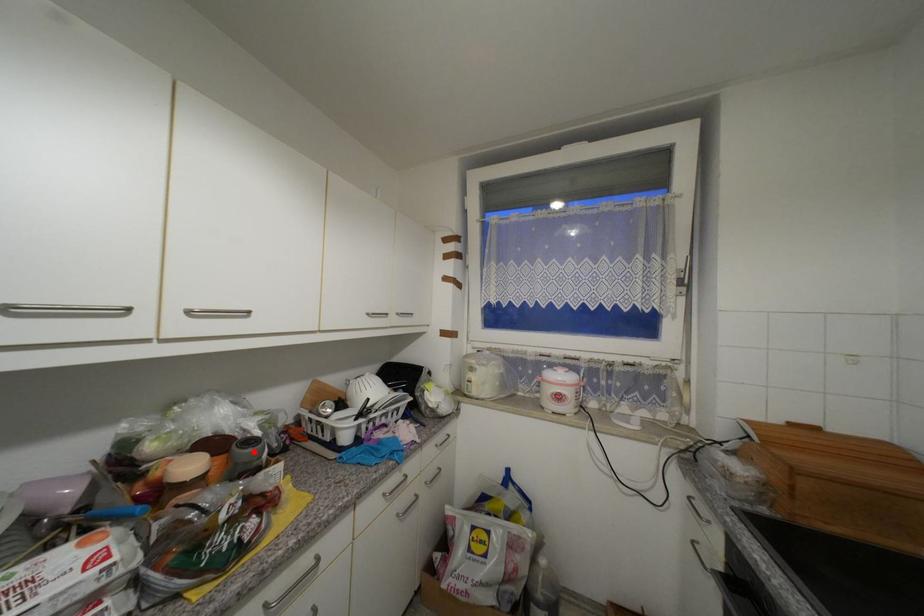
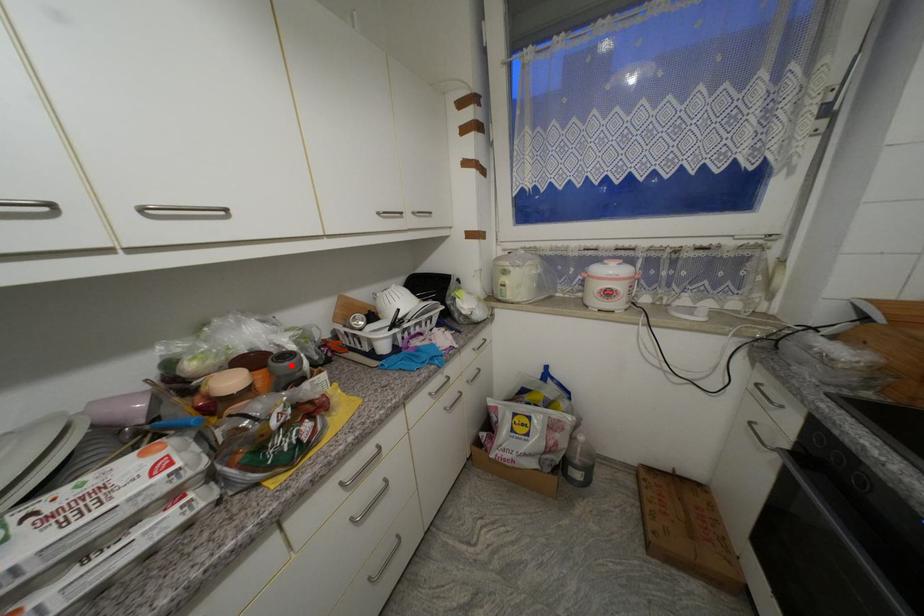
I am providing you with two images of the same scene from different viewpoints. A red point is marked on the first image and another point is marked on the second image. Is the marked point in image1 the same physical position as the marked point in image2?

Yes